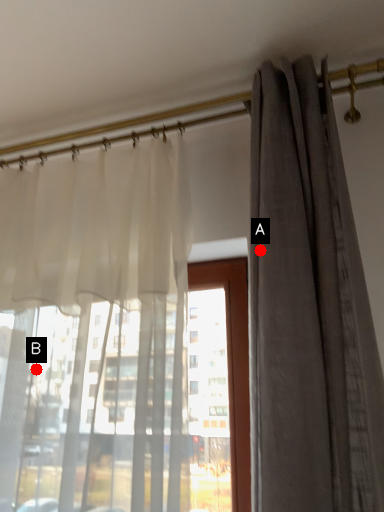
Question: Two points are circled on the image, labeled by A and B beside each circle. Which point is closer to the camera?

Choices:
 (A) A is closer
 (B) B is closer

Answer: (A)